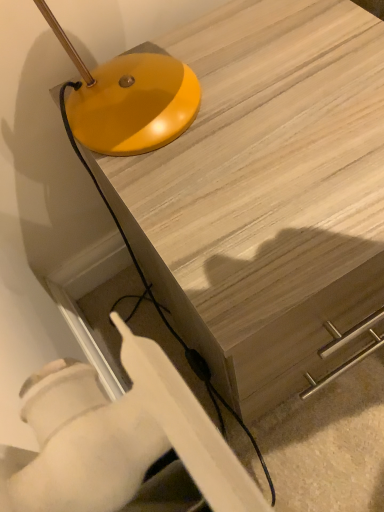
Image resolution: width=384 pixels, height=512 pixels. What do you see at coordinates (129, 100) in the screenshot? I see `matte yellow lampshade at upper left` at bounding box center [129, 100].

The width and height of the screenshot is (384, 512). Find the location of `matte yellow lampshade at upper left`. matte yellow lampshade at upper left is located at coordinates tap(129, 100).

At what (x,y) coordinates should I click in order to perform the action: click on matte yellow lampshade at upper left. Please return your answer as a coordinate pair (x, y). The width and height of the screenshot is (384, 512). Looking at the image, I should click on (129, 100).